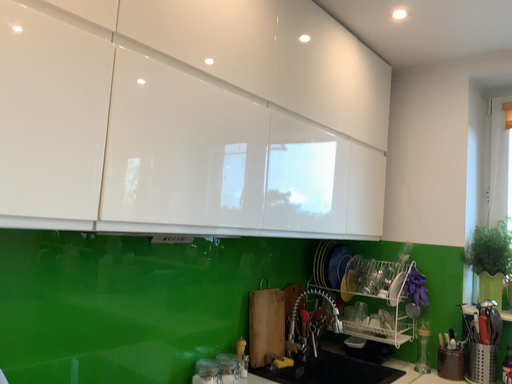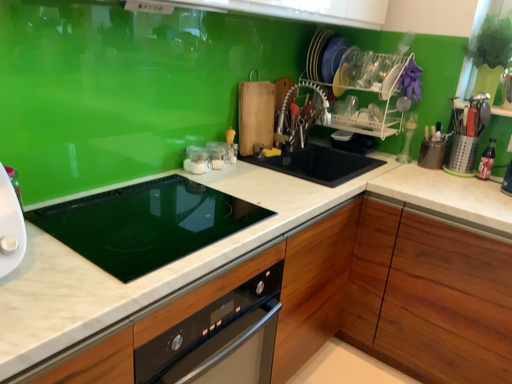
Question: Which way did the camera rotate in the video?

Choices:
 (A) rotated upward
 (B) rotated downward

Answer: (B)